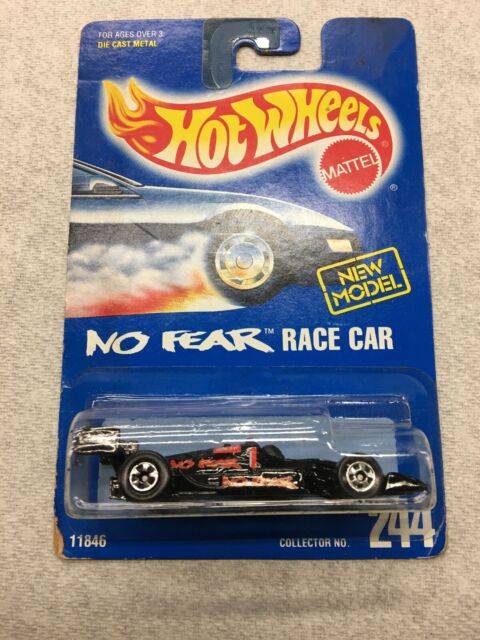
This screenshot has width=480, height=640. Find the location of `cardboard backing`. cardboard backing is located at coordinates (377, 44), (74, 367).